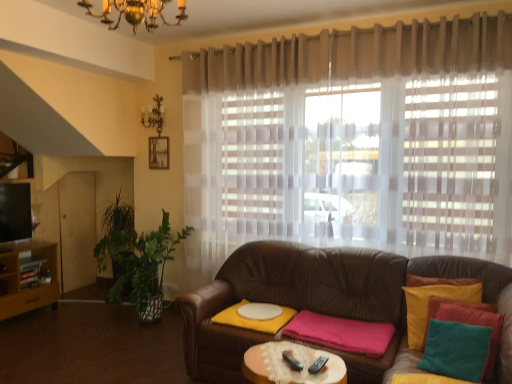
Image resolution: width=512 pixels, height=384 pixels. Identify the location of sheer beige curtain at upper center. (352, 141).

The height and width of the screenshot is (384, 512). What do you see at coordinates (352, 141) in the screenshot?
I see `sheer beige curtain at upper center` at bounding box center [352, 141].

The image size is (512, 384). I want to click on brown leather couch at center, so click(315, 299).

Image resolution: width=512 pixels, height=384 pixels. What do you see at coordinates (315, 299) in the screenshot? I see `brown leather couch at center` at bounding box center [315, 299].

Find the location of a particular element. This screenshot has height=384, width=512. sheer beige curtain at upper center is located at coordinates (352, 141).

Is sheer beige curtain at upper center to the left of brown leather couch at center from the viewer's perspective?

No, sheer beige curtain at upper center is not to the left of brown leather couch at center.

Is sheer beige curtain at upper center closer to camera compared to brown leather couch at center?

No, sheer beige curtain at upper center is behind brown leather couch at center.

Does point (472, 216) come closer to viewer compared to point (340, 294)?

Yes, point (472, 216) is closer to viewer.

From the image's perspective, which is below, sheer beige curtain at upper center or brown leather couch at center?

From the image's view, brown leather couch at center is below.

From a real-world perspective, between sheer beige curtain at upper center and brown leather couch at center, who is vertically higher?

From a 3D spatial view, sheer beige curtain at upper center is above.

From the picture: Considering the relative sizes of sheer beige curtain at upper center and brown leather couch at center in the image provided, is sheer beige curtain at upper center wider than brown leather couch at center?

In fact, sheer beige curtain at upper center might be narrower than brown leather couch at center.

Is sheer beige curtain at upper center shorter than brown leather couch at center?

No.

Can you confirm if sheer beige curtain at upper center is bigger than brown leather couch at center?

Incorrect, sheer beige curtain at upper center is not larger than brown leather couch at center.

Is sheer beige curtain at upper center inside the boundaries of brown leather couch at center, or outside?

sheer beige curtain at upper center is located beyond the bounds of brown leather couch at center.

Is sheer beige curtain at upper center beside brown leather couch at center?

There is a gap between sheer beige curtain at upper center and brown leather couch at center.

Does sheer beige curtain at upper center turn towards brown leather couch at center?

No, sheer beige curtain at upper center does not turn towards brown leather couch at center.

Can you tell me how much sheer beige curtain at upper center and brown leather couch at center differ in facing direction?

The angle between the facing direction of sheer beige curtain at upper center and the facing direction of brown leather couch at center is 0.246 degrees.

The height and width of the screenshot is (384, 512). Identify the location of curtain to the right of brown leather couch at center. (352, 141).

Considering the relative positions of brown leather couch at center and sheer beige curtain at upper center in the image provided, is brown leather couch at center to the left or to the right of sheer beige curtain at upper center?

Based on their positions, brown leather couch at center is located to the left of sheer beige curtain at upper center.

From the picture: Is the depth of brown leather couch at center greater than that of sheer beige curtain at upper center?

No, brown leather couch at center is closer to the camera.

Is point (496, 292) positioned after point (237, 242)?

No, it is in front of (237, 242).

From the image's perspective, which object appears higher, brown leather couch at center or sheer beige curtain at upper center?

sheer beige curtain at upper center is shown above in the image.

From a real-world perspective, who is located higher, brown leather couch at center or sheer beige curtain at upper center?

From a 3D spatial view, sheer beige curtain at upper center is above.

Which object is wider, brown leather couch at center or sheer beige curtain at upper center?

Wider between the two is brown leather couch at center.

Considering the relative sizes of brown leather couch at center and sheer beige curtain at upper center in the image provided, is brown leather couch at center taller than sheer beige curtain at upper center?

No, brown leather couch at center is not taller than sheer beige curtain at upper center.

Between brown leather couch at center and sheer beige curtain at upper center, which one has smaller size?

Smaller between the two is sheer beige curtain at upper center.

Do you think brown leather couch at center is within sheer beige curtain at upper center, or outside of it?

brown leather couch at center is located beyond the bounds of sheer beige curtain at upper center.

Is brown leather couch at center directly adjacent to sheer beige curtain at upper center?

No.

Is sheer beige curtain at upper center at the back of brown leather couch at center?

No.

Can you tell me how much brown leather couch at center and sheer beige curtain at upper center differ in facing direction?

0.246 degrees.

Locate an element on the screen. This screenshot has width=512, height=384. studio couch to the left of sheer beige curtain at upper center is located at coordinates (315, 299).

The width and height of the screenshot is (512, 384). I want to click on studio couch in front of the sheer beige curtain at upper center, so click(x=315, y=299).

In the image, there is a sheer beige curtain at upper center. Where is `studio couch below it (from the image's perspective)`? The height and width of the screenshot is (384, 512). studio couch below it (from the image's perspective) is located at coordinates (315, 299).